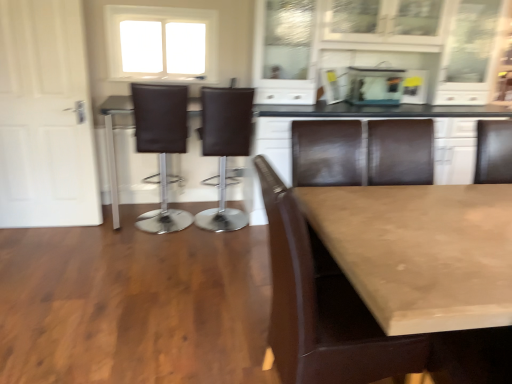
Locate an element on the screen. free region under white frosted glass window at upper center (from a real-world perspective) is located at coordinates (159, 81).